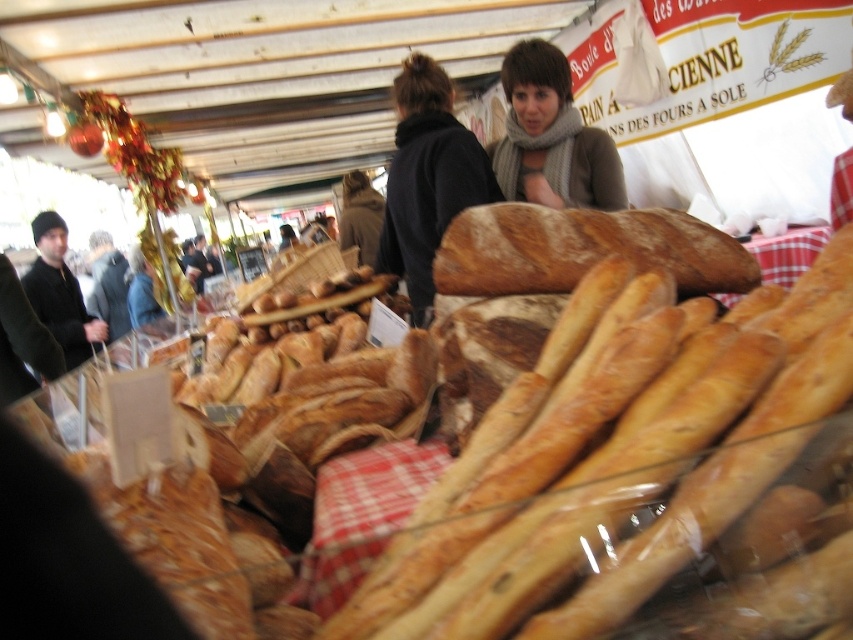
Question: From the image, what is the correct spatial relationship of golden brown crusty loaf at center in relation to black knit hat at left?

Choices:
 (A) above
 (B) below

Answer: (B)

Question: Among these points, which one is farthest from the camera?

Choices:
 (A) (587, 221)
 (B) (573, 529)
 (C) (526, 132)
 (D) (461, 164)

Answer: (C)

Question: Is golden brown crusty loaf at center bigger than black knit hat at left?

Choices:
 (A) yes
 (B) no

Answer: (B)

Question: Which of the following is the closest to the observer?

Choices:
 (A) golden brown crusty loaf at center
 (B) gray scarf at upper center

Answer: (A)

Question: Which of these objects is positioned closest to the black knit hat at left?

Choices:
 (A) golden brown crusty loaf at center
 (B) black woolen sweater at upper center
 (C) golden brown crusty baguette at center

Answer: (B)

Question: In this image, where is gray scarf at upper center located relative to black knit hat at left?

Choices:
 (A) left
 (B) right

Answer: (B)